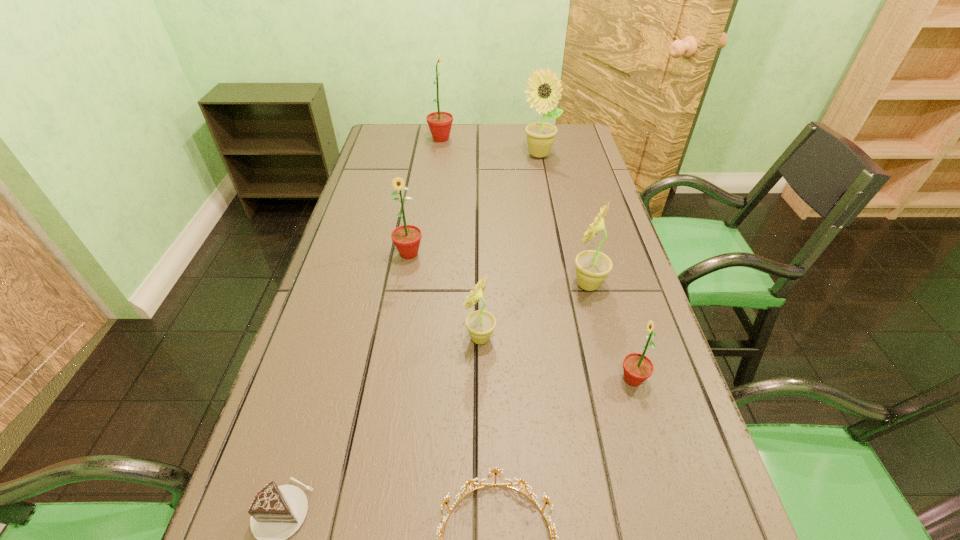
Locate an element on the screen. the rightmost green sunflower is located at coordinates pyautogui.click(x=637, y=367).

The height and width of the screenshot is (540, 960). Find the location of `the nearest sunflower`. the nearest sunflower is located at coordinates (x=637, y=367).

This screenshot has height=540, width=960. I want to click on vacant space located on the face of the farthest green sunflower, so click(x=475, y=139).

Find the location of `vacant space located 0.360m on the face of the farthest yellow sunflower`. vacant space located 0.360m on the face of the farthest yellow sunflower is located at coordinates (552, 227).

Locate an element on the screen. This screenshot has height=540, width=960. free region located on the face of the second nearest yellow sunflower is located at coordinates (432, 285).

Find the location of a particular element. This screenshot has height=540, width=960. vacant space located on the face of the second nearest yellow sunflower is located at coordinates (428, 285).

Locate an element on the screen. The image size is (960, 540). vacant space located on the face of the second nearest yellow sunflower is located at coordinates (541, 285).

Locate an element on the screen. vacant space located 0.240m on the face of the sixth nearest object is located at coordinates (395, 337).

Identify the location of free location located 0.130m on the face of the fourth nearest object. The height and width of the screenshot is (540, 960). (406, 338).

The width and height of the screenshot is (960, 540). In order to click on vacant space located 0.250m on the face of the fourth nearest object in this screenshot , I will do `click(351, 338)`.